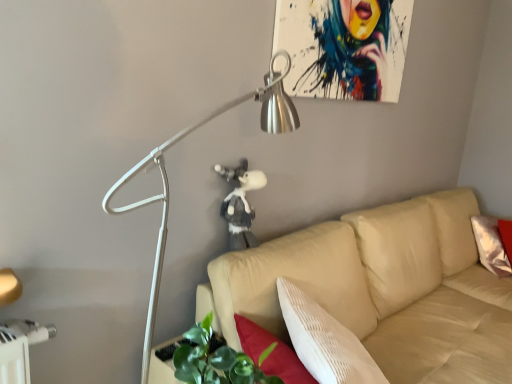
Question: From a real-world perspective, is fluffy gray plush at center physically located above or below beige fabric couch at center?

Choices:
 (A) above
 (B) below

Answer: (A)

Question: Is point (236, 223) closer or farther from the camera than point (401, 299)?

Choices:
 (A) farther
 (B) closer

Answer: (B)

Question: Estimate the real-world distances between objects in this image. Which object is closer to the beige fabric couch at center?

Choices:
 (A) fluffy gray plush at center
 (B) metallic silver lamp at upper left

Answer: (A)

Question: Estimate the real-world distances between objects in this image. Which object is closer to the metallic silver lamp at upper left?

Choices:
 (A) fluffy gray plush at center
 (B) beige fabric couch at center

Answer: (A)